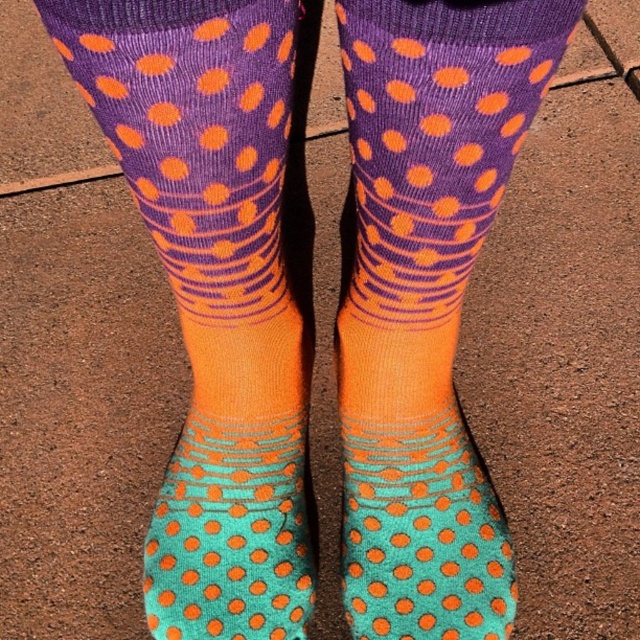
You are trying to determine which pair of socks is nearer to you in the image. Both the orange dotted socks at center and the teal matte socks at center are visible. Which one is closer?

The orange dotted socks at center is closer to the viewer than the teal matte socks at center.

You are holding a camera and want to take a photo of the matte purple socks at center. If the camera requires the subject to be at least 24 inches away for clear focus, will the current distance of 24.57 inches work?

The matte purple socks at center are 24.57 inches away from the camera, which is just over the minimum required distance of 24 inches. This distance should allow for a clear focus.